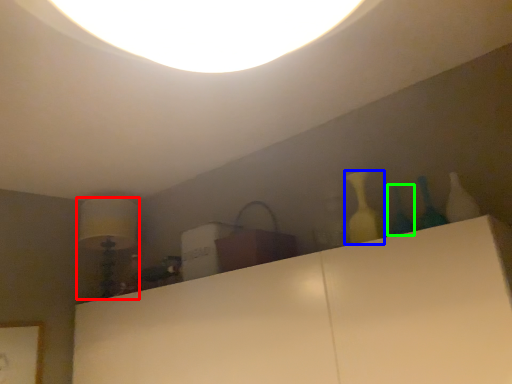
Question: Which object is the closest to the lamp (highlighted by a red box)? Choose among these: bottle (highlighted by a blue box) or glass vase (highlighted by a green box).

Choices:
 (A) bottle
 (B) glass vase

Answer: (A)